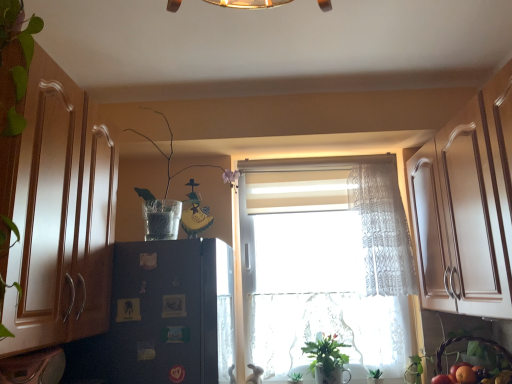
Describe the element at coordinates (170, 312) in the screenshot. I see `black matte refrigerator at left` at that location.

What is the approximate height of wooden cabinet at left?

wooden cabinet at left is 27.66 inches in height.

Measure the distance between green leafy plant at lower center, which is the 2th plant in left-to-right order, and camera.

green leafy plant at lower center, which is the 2th plant in left-to-right order, and camera are 1.94 meters apart from each other.

You are a GUI agent. You are given a task and a screenshot of the screen. Output one action in this format:
    pyautogui.click(x=<x>, y=<y>)
    Task: Click on the white lace curtain at center
    The width and height of the screenshot is (512, 384).
    Given the screenshot: What is the action you would take?
    pyautogui.click(x=382, y=230)

How many degrees apart are the facing directions of brown woven basket at lower right and black matte refrigerator at left?

The angular difference between brown woven basket at lower right and black matte refrigerator at left is 139 degrees.

Which of these two, brown woven basket at lower right or black matte refrigerator at left, is wider?

black matte refrigerator at left is wider.

From the image's perspective, which is above, brown woven basket at lower right or black matte refrigerator at left?

black matte refrigerator at left appears higher in the image.

Does brown woven basket at lower right turn towards black matte refrigerator at left?

No, brown woven basket at lower right is not facing towards black matte refrigerator at left.

Is clear glass vase at upper center, the second plant from the back, located within white lace curtain at center?

That's incorrect, clear glass vase at upper center, the second plant from the back, is not inside white lace curtain at center.

Is white lace curtain at center aimed at clear glass vase at upper center, the second plant in the right-to-left sequence?

No.

Which is behind, point (390, 269) or point (157, 113)?

Point (157, 113)

Image resolution: width=512 pixels, height=384 pixels. Find the location of `plant above the white lace curtain at center (from the image's perspective)`. plant above the white lace curtain at center (from the image's perspective) is located at coordinates (189, 165).

From the image's perspective, between white lace curtain at center and black matte refrigerator at left, which one is located above?

white lace curtain at center appears higher in the image.

Does white lace curtain at center turn towards black matte refrigerator at left?

No, white lace curtain at center is not aimed at black matte refrigerator at left.

Which is less distant, [370,194] or [170,264]?

Point [370,194].

How different are the orientations of white lace curtain at center and black matte refrigerator at left in degrees?

There is a 91.9-degree angle between the facing directions of white lace curtain at center and black matte refrigerator at left.

Looking at their sizes, would you say green matte plant at lower center is wider or thinner than wooden cabinet at left?

In the image, green matte plant at lower center appears to be more narrow than wooden cabinet at left.

From the image's perspective, which one is positioned lower, green matte plant at lower center or wooden cabinet at left?

green matte plant at lower center is shown below in the image.

Is green matte plant at lower center inside the boundaries of wooden cabinet at left, or outside?

The correct answer is: outside.

Between green matte plant at lower center and wooden cabinet at left, which one has larger size?

Bigger between the two is wooden cabinet at left.

Does point (294, 380) come in front of point (165, 193)?

Yes, point (294, 380) is in front of point (165, 193).

Where is `plant located behind the clear glass vase at upper center, the first plant when ordered from front to back`? plant located behind the clear glass vase at upper center, the first plant when ordered from front to back is located at coordinates (295, 378).

Does green leafy plant at lower center, placed as the 2th plant when sorted from front to back, touch clear glass vase at upper center, the first plant when ordered from top to bottom?

No, green leafy plant at lower center, placed as the 2th plant when sorted from front to back, is not making contact with clear glass vase at upper center, the first plant when ordered from top to bottom.

Is green leafy plant at lower center, positioned as the 1th plant in back-to-front order, wider or thinner than white lace curtain at center?

In the image, green leafy plant at lower center, positioned as the 1th plant in back-to-front order, appears to be more narrow than white lace curtain at center.

Does point (291, 376) lie in front of point (378, 209)?

Yes, it is in front of point (378, 209).

This screenshot has width=512, height=384. What are the coordinates of `plant located underneath the white lace curtain at center (from a real-world perspective)` in the screenshot? It's located at (295, 378).

This screenshot has width=512, height=384. Identify the location of the 2nd plant to the left when counting from the green matte plant at lower center. (189, 165).

Can you confirm if clear glass vase at upper center, acting as the first plant starting from the left, is positioned to the right of green matte plant at lower center?

No.

Between clear glass vase at upper center, acting as the first plant starting from the left, and green matte plant at lower center, which one has larger width?

clear glass vase at upper center, acting as the first plant starting from the left, is wider.

Which object is closer to the camera taking this photo, clear glass vase at upper center, the 2th plant from the bottom, or green matte plant at lower center?

clear glass vase at upper center, the 2th plant from the bottom, is in front.

Find the location of a particular element. The height and width of the screenshot is (384, 512). basket directly beneath the black matte refrigerator at left (from a real-world perspective) is located at coordinates (469, 340).

Where is `plant above the white lace curtain at center (from the image's perspective)`? The height and width of the screenshot is (384, 512). plant above the white lace curtain at center (from the image's perspective) is located at coordinates (189, 165).

Looking at the image, which one is located closer to clear glass vase at upper center, the 2th plant from the bottom, green leafy plant at lower center, the first plant viewed from the right, or black matte refrigerator at left?

black matte refrigerator at left is closer to clear glass vase at upper center, the 2th plant from the bottom.

When comparing their distances from green matte plant at lower center, does green leafy plant at lower center, the first plant viewed from the right, or white lace curtain at center seem further?

The object further to green matte plant at lower center is white lace curtain at center.

Considering their positions, is clear glass vase at upper center, the first plant when ordered from front to back, positioned closer to green matte plant at lower center than orange matte at lower right?

orange matte at lower right.

Looking at this image, which object lies nearer to the anchor point wooden cabinet at left, black matte refrigerator at left or clear glass vase at upper center, the 2th plant from the bottom?

The object closer to wooden cabinet at left is black matte refrigerator at left.

Based on their spatial positions, is clear glass vase at upper center, the 2th plant from the bottom, or green matte plant at lower center closer to black matte refrigerator at left?

clear glass vase at upper center, the 2th plant from the bottom, is positioned closer to the anchor black matte refrigerator at left.

Estimate the real-world distances between objects in this image. Which object is closer to orange matte at lower right, green matte plant at lower center or wooden cabinet at left?

green matte plant at lower center is positioned closer to the anchor orange matte at lower right.

Based on their spatial positions, is wooden cabinet at left or clear glass vase at upper center, the 2th plant from the bottom, further from white lace curtain at center?

wooden cabinet at left is further to white lace curtain at center.

When comparing their distances from clear glass vase at upper center, the first plant when ordered from top to bottom, does orange matte at lower right or green leafy plant at lower center, placed as the 2th plant when sorted from front to back, seem further?

orange matte at lower right is further to clear glass vase at upper center, the first plant when ordered from top to bottom.

This screenshot has width=512, height=384. I want to click on curtain located between wooden cabinet at left and brown woven basket at lower right in the left-right direction, so click(382, 230).

This screenshot has height=384, width=512. I want to click on fridge between clear glass vase at upper center, the second plant in the right-to-left sequence, and green matte plant at lower center from top to bottom, so click(170, 312).

Where is `fruit between green leafy plant at lower center, which appears as the 1th plant when ordered from the bottom, and brown woven basket at lower right from left to right`? This screenshot has height=384, width=512. fruit between green leafy plant at lower center, which appears as the 1th plant when ordered from the bottom, and brown woven basket at lower right from left to right is located at coordinates (465, 375).

Where is `fridge between wooden cabinet at left and green leafy plant at lower center, the first plant viewed from the right, along the z-axis`? Image resolution: width=512 pixels, height=384 pixels. fridge between wooden cabinet at left and green leafy plant at lower center, the first plant viewed from the right, along the z-axis is located at coordinates (170, 312).